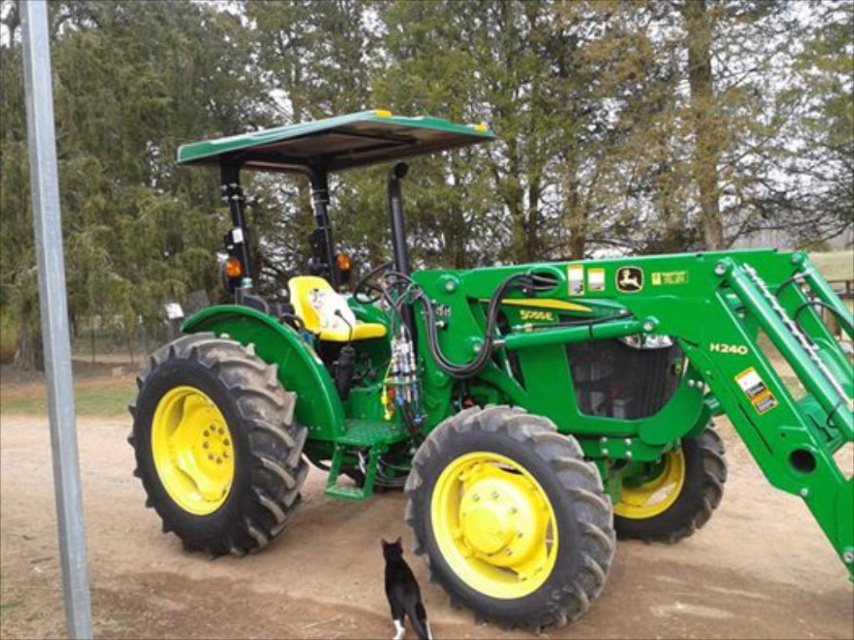
You are driving a tractor and need to move forward. There is a dirt track at lower center and a black fur cat at lower center in front of you. Can you safely drive over them without hitting anything?

The dirt track at lower center and black fur cat at lower center are 3.58 meters apart from each other. Since the cat is on the dirt track, you should stop to avoid hitting the cat. The tractor cannot safely drive over them both at the same time.

You are a farmer standing at the edge of your field. You see the green matte tractor at center and the black fur cat at lower center. Which one do you need to look up to see?

The green matte tractor at center is much taller than the black fur cat at lower center, so you need to look up to see the green matte tractor at center.

Consider the image. You are a photographer trying to capture both the green matte tractor at center and the black fur cat at lower center in a single frame. Given their sizes, which object should you focus on to ensure both are clearly visible in the photo?

The green matte tractor at center is bigger than the black fur cat at lower center, so you should focus on the green matte tractor at center to ensure both are clearly visible in the photo.